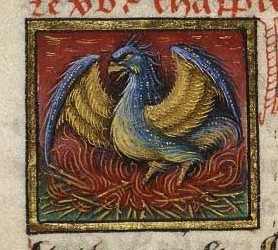
The image size is (278, 250). In order to click on cream colored background in this screenshot , I will do `click(11, 71)`.